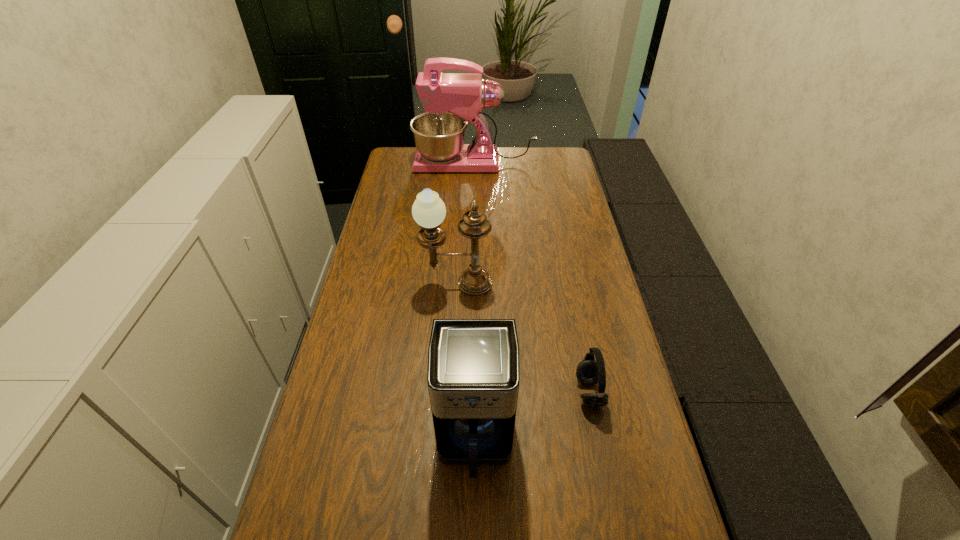
Identify the location of the farthest object. (451, 100).

Image resolution: width=960 pixels, height=540 pixels. Find the location of `the tallest object`. the tallest object is located at coordinates click(x=451, y=100).

Identify the location of oil lamp. (428, 210).

Identify the location of coffee maker. The height and width of the screenshot is (540, 960). tap(473, 376).

The height and width of the screenshot is (540, 960). Find the location of `the rightmost object`. the rightmost object is located at coordinates (589, 371).

At what (x,y) coordinates should I click in order to perform the action: click on headset. Please return your answer as a coordinate pair (x, y). Image resolution: width=960 pixels, height=540 pixels. Looking at the image, I should click on (589, 371).

Where is `vacant space located on the back of the oil lamp`? This screenshot has width=960, height=540. vacant space located on the back of the oil lamp is located at coordinates (461, 212).

Where is `vacant space located 0.090m on the front panel of the coffee maker`? This screenshot has height=540, width=960. vacant space located 0.090m on the front panel of the coffee maker is located at coordinates (474, 529).

Find the location of a particular element. This screenshot has width=960, height=540. vacant area located 0.400m on the ear cups of the shortest object is located at coordinates (422, 392).

This screenshot has width=960, height=540. I want to click on vacant space situated 0.270m on the ear cups of the shortest object, so click(x=472, y=392).